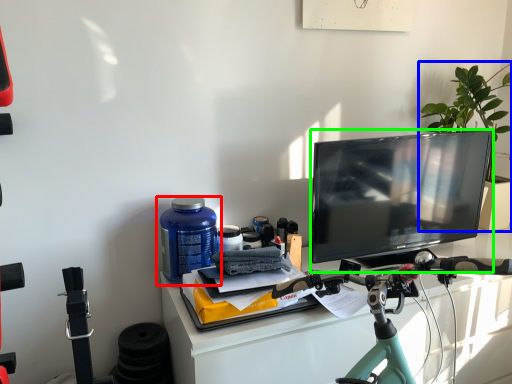
Question: Which object is the closest to the bottle (highlighted by a red box)? Choose among these: houseplant (highlighted by a blue box) or television (highlighted by a green box).

Choices:
 (A) houseplant
 (B) television

Answer: (B)